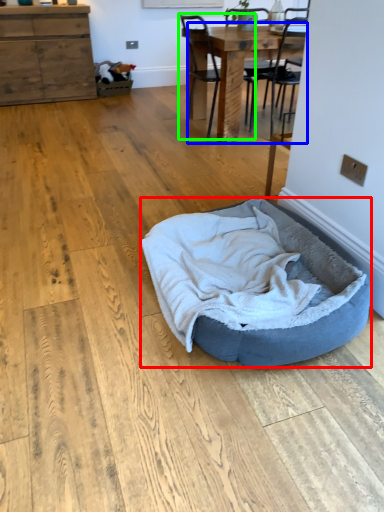
Question: Which is nearer to the dog bed (highlighted by a red box)? table (highlighted by a blue box) or chair (highlighted by a green box).

Choices:
 (A) table
 (B) chair

Answer: (A)